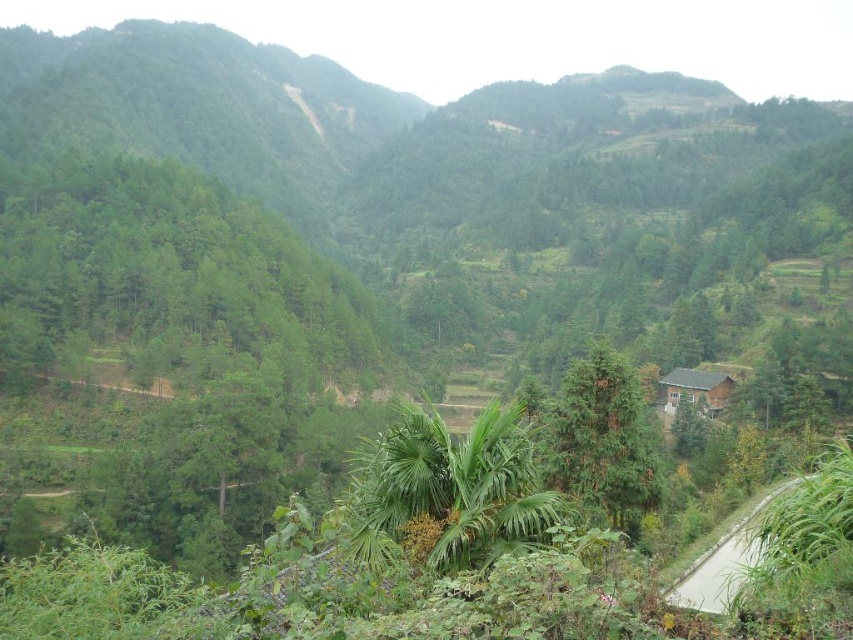
You are standing at the point marked as point (602, 440) in the image. What is the nearest object to you?

The point (602, 440) is on green matte tree at center, so the nearest object to you is the green matte tree at center.